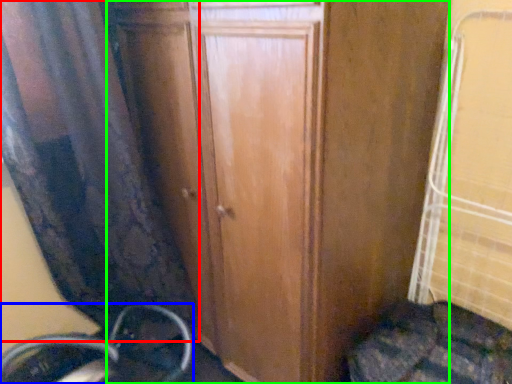
Question: Estimate the real-world distances between objects in this image. Which object is farther from curtain (highlighted by a red box), wheel (highlighted by a blue box) or door (highlighted by a green box)?

Choices:
 (A) wheel
 (B) door

Answer: (A)